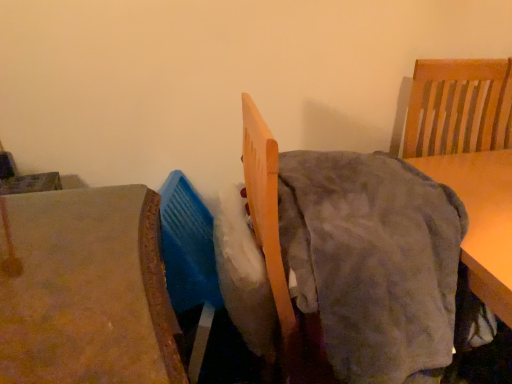
The image size is (512, 384). Find the location of `gray suede blanket at center`. gray suede blanket at center is located at coordinates (373, 261).

What do you see at coordinates (373, 261) in the screenshot?
I see `gray suede blanket at center` at bounding box center [373, 261].

You are a GUI agent. You are given a task and a screenshot of the screen. Output one action in this format:
    pyautogui.click(x=<x>, y=<y>)
    Task: Click on the gray suede blanket at center
    
    Given the screenshot: What is the action you would take?
    pyautogui.click(x=373, y=261)